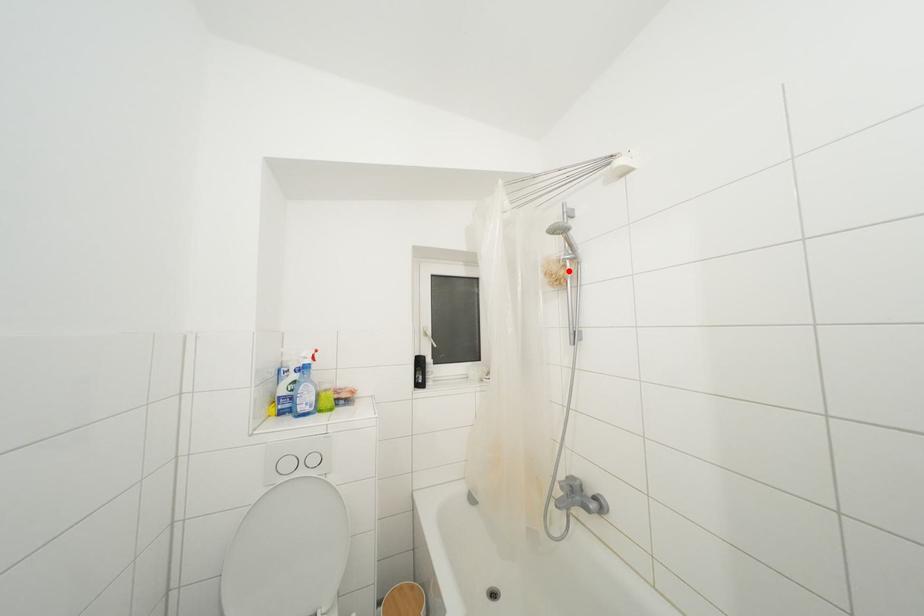
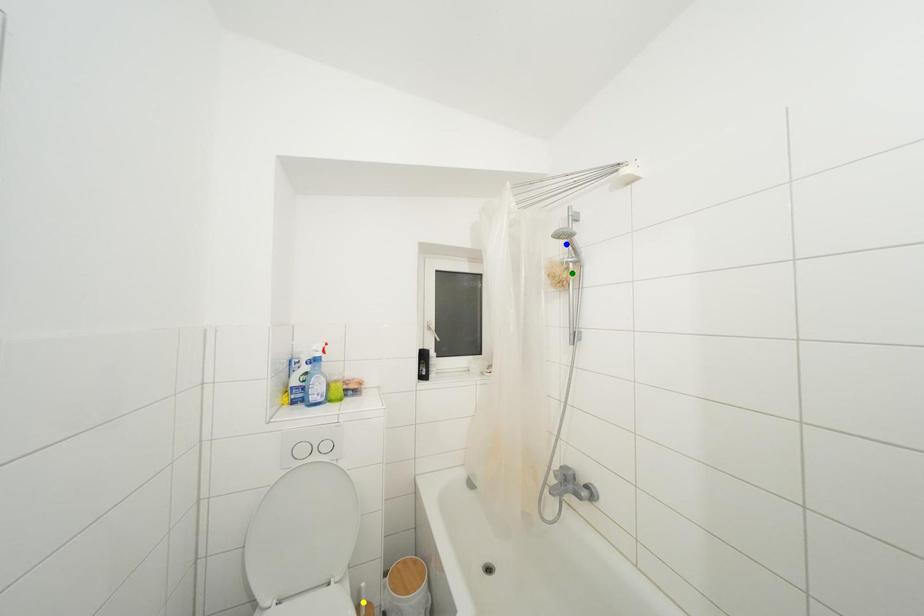
Question: I am providing you with two images of the same scene from different viewpoints. A red point is marked on the first image. You are given multiple points on the second image. Which point in image 2 represents the same 3d spot as the red point in image 1?

Choices:
 (A) blue point
 (B) green point
 (C) yellow point

Answer: (B)